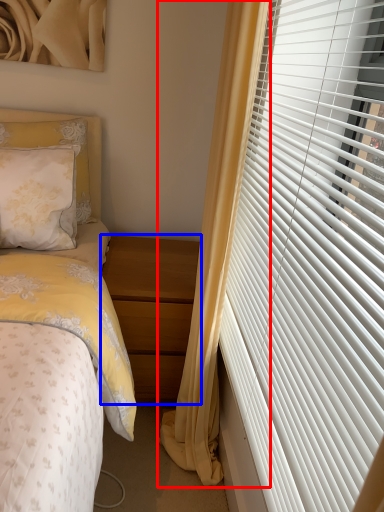
Question: Which of the following is the farthest to the observer, curtain (highlighted by a red box) or nightstand (highlighted by a blue box)?

Choices:
 (A) curtain
 (B) nightstand

Answer: (B)